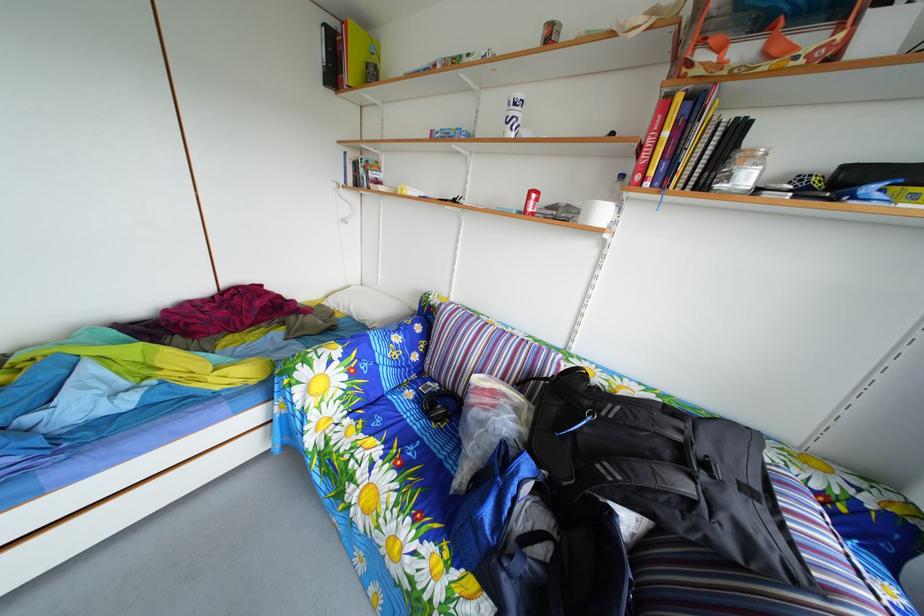
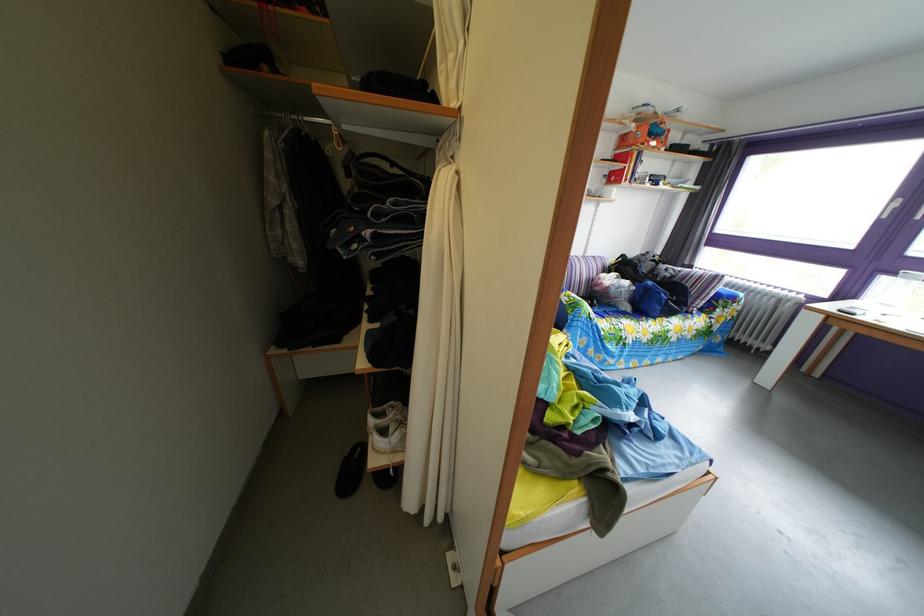
Locate, in the second image, the point that corresponds to pixel 581 347 in the first image.

(596, 261)